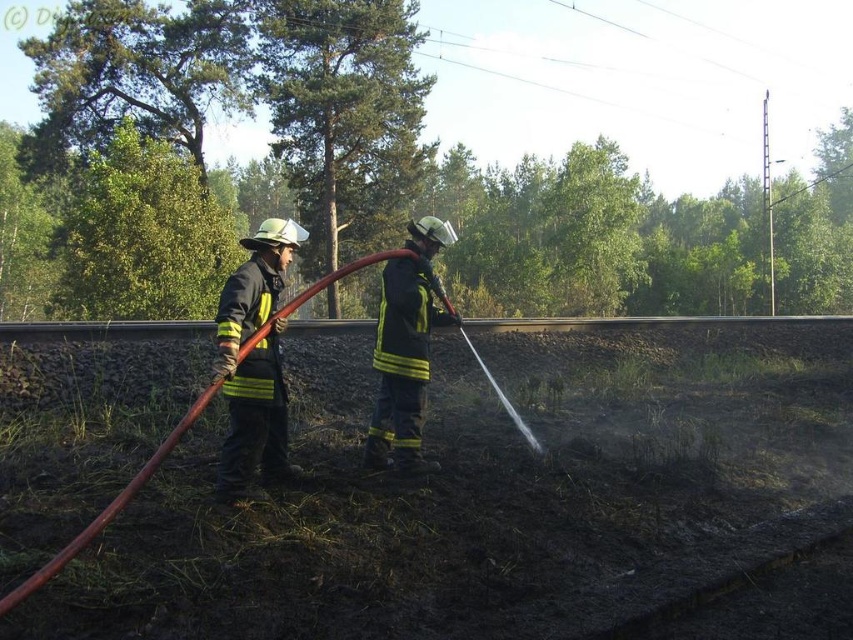
Identify the location of reflective yellow jacket at center. The width and height of the screenshot is (853, 640). (254, 360).

Who is taller, reflective yellow jacket at center or reflective yellow uniform at center?

reflective yellow jacket at center is taller.

Is point (254, 312) positioned behind point (393, 330)?

No, (254, 312) is closer to viewer.

At what (x,y) coordinates should I click in order to perform the action: click on reflective yellow jacket at center. Please return your answer as a coordinate pair (x, y). Looking at the image, I should click on (254, 360).